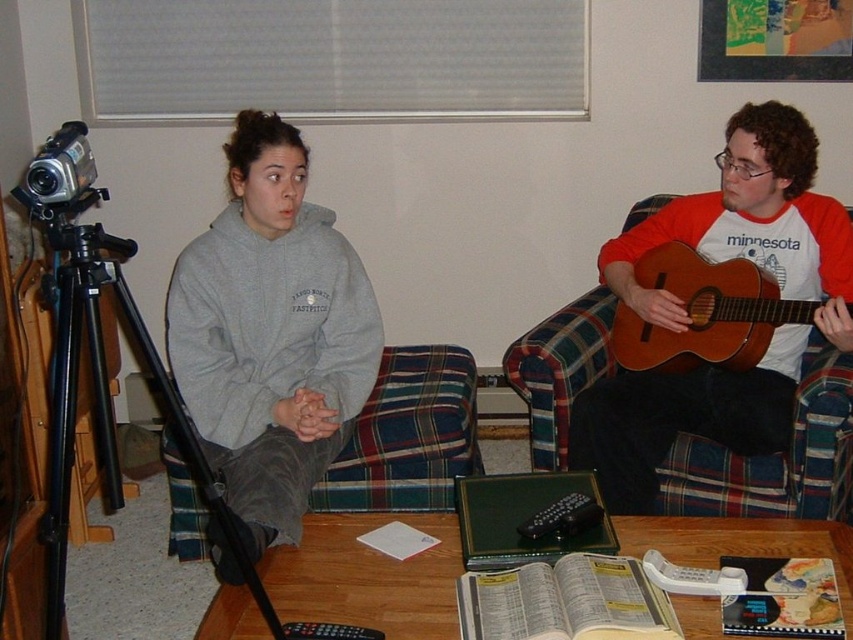
Looking at this image, you are a photographer standing in front of the sofa and need to adjust the focus on your camera. Which object, the brown wooden guitar at right or the black plastic remote at lower center, is closer to you so you can focus on it first?

The brown wooden guitar at right is closer to you than the black plastic remote at lower center, so you should focus on the brown wooden guitar at right first.

Where is the gray fleece sweatshirt at center located in the image?

The gray fleece sweatshirt at center is located at point coordinates of 0.522 on the x axis and 0.318 on the y axis.

You are a photographer standing in the room and want to take a photo of both the gray fleece sweatshirt at center and the brown wooden guitar at right. Which object should you focus on first to ensure both are in clear view?

The gray fleece sweatshirt at center is closer to the viewer than the brown wooden guitar at right, so you should focus on the gray fleece sweatshirt at center first to ensure both are in clear view.